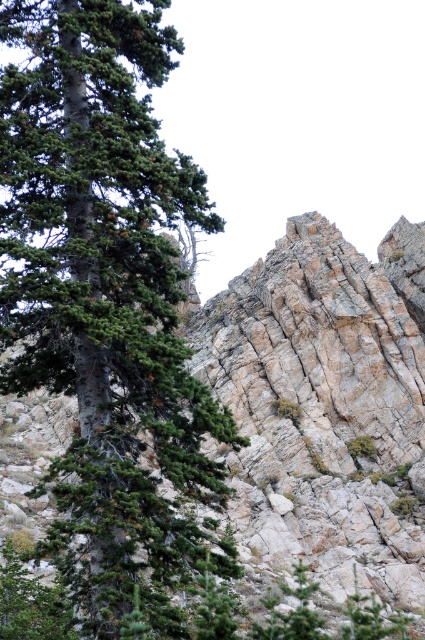
Question: Which point is farther to the camera?

Choices:
 (A) (113, 84)
 (B) (391, 570)

Answer: (B)

Question: Does green matte tree at left come behind rugged stone mountain at center?

Choices:
 (A) yes
 (B) no

Answer: (B)

Question: Can you confirm if green matte tree at left is thinner than rugged stone mountain at center?

Choices:
 (A) no
 (B) yes

Answer: (B)

Question: Among these points, which one is farthest from the camera?

Choices:
 (A) (303, 476)
 (B) (53, 193)

Answer: (A)

Question: Can you confirm if green matte tree at left is wider than rugged stone mountain at center?

Choices:
 (A) yes
 (B) no

Answer: (B)